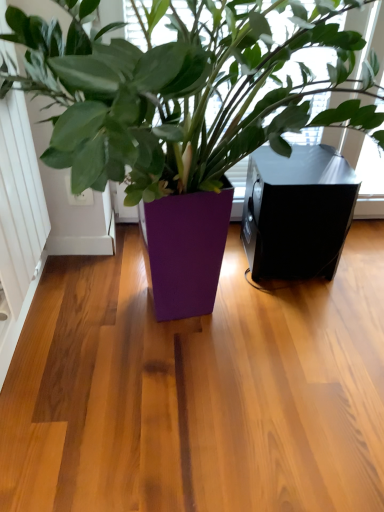
Question: Is white matte screen door at left turned away from purple glossy planter at center?

Choices:
 (A) no
 (B) yes

Answer: (A)

Question: Considering the relative sizes of white matte screen door at left and purple glossy planter at center in the image provided, is white matte screen door at left wider than purple glossy planter at center?

Choices:
 (A) no
 (B) yes

Answer: (A)

Question: From the image's perspective, is white matte screen door at left beneath purple glossy planter at center?

Choices:
 (A) no
 (B) yes

Answer: (A)

Question: From the image's perspective, is white matte screen door at left on top of purple glossy planter at center?

Choices:
 (A) no
 (B) yes

Answer: (B)

Question: Is white matte screen door at left bigger than purple glossy planter at center?

Choices:
 (A) no
 (B) yes

Answer: (A)

Question: Is purple glossy planter at center situated inside white matte screen door at left or outside?

Choices:
 (A) inside
 (B) outside

Answer: (B)

Question: Is purple glossy planter at center to the left or to the right of white matte screen door at left in the image?

Choices:
 (A) left
 (B) right

Answer: (B)

Question: Is point (109, 145) positioned closer to the camera than point (18, 128)?

Choices:
 (A) closer
 (B) farther

Answer: (A)

Question: Considering the positions of purple glossy planter at center and white matte screen door at left in the image, is purple glossy planter at center wider or thinner than white matte screen door at left?

Choices:
 (A) thin
 (B) wide

Answer: (B)

Question: Considering their positions, is black matte speaker at right located in front of or behind white matte screen door at left?

Choices:
 (A) front
 (B) behind

Answer: (B)

Question: Looking at the image, does black matte speaker at right seem bigger or smaller compared to white matte screen door at left?

Choices:
 (A) big
 (B) small

Answer: (A)

Question: From a real-world perspective, is black matte speaker at right positioned above or below white matte screen door at left?

Choices:
 (A) below
 (B) above

Answer: (A)

Question: From the image's perspective, is black matte speaker at right located above or below white matte screen door at left?

Choices:
 (A) above
 (B) below

Answer: (B)

Question: Is white matte screen door at left in front of or behind purple glossy planter at center in the image?

Choices:
 (A) behind
 (B) front

Answer: (A)

Question: From the image's perspective, is white matte screen door at left located above or below purple glossy planter at center?

Choices:
 (A) above
 (B) below

Answer: (A)